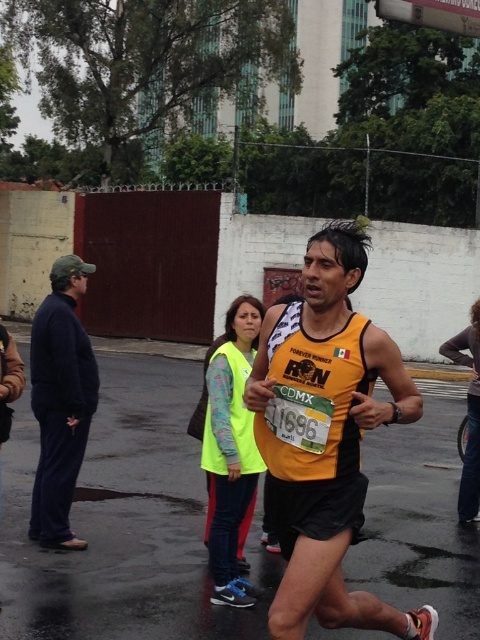
Who is more forward, (45, 412) or (205, 422)?

Point (205, 422) is more forward.

Can you confirm if dark blue fleece at left is positioned below neon yellow vest at center?

Incorrect, dark blue fleece at left is not positioned below neon yellow vest at center.

Between point (51, 499) and point (237, 429), which one is positioned in front?

Point (237, 429) is more forward.

What are the coordinates of `dark blue fleece at left` in the screenshot? It's located at (60, 401).

Between yellow fabric tank top at center and dark blue fleece at left, which one appears on the left side from the viewer's perspective?

From the viewer's perspective, dark blue fleece at left appears more on the left side.

Is yellow fabric tank top at center bigger than dark blue fleece at left?

Yes, yellow fabric tank top at center is bigger than dark blue fleece at left.

You are a GUI agent. You are given a task and a screenshot of the screen. Output one action in this format:
    pyautogui.click(x=<x>, y=<y>)
    Task: Click on the yellow fabric tank top at center
    
    Given the screenshot: What is the action you would take?
    pyautogui.click(x=325, y=436)

At what (x,y) coordinates should I click in order to perform the action: click on yellow fabric tank top at center. Please return your answer as a coordinate pair (x, y). The width and height of the screenshot is (480, 640). Looking at the image, I should click on (325, 436).

Is yellow fabric tank top at center wider than neon yellow vest at center?

Indeed, yellow fabric tank top at center has a greater width compared to neon yellow vest at center.

Between yellow fabric tank top at center and neon yellow vest at center, which one has more height?

With more height is yellow fabric tank top at center.

Which is in front, point (303, 460) or point (230, 493)?

Positioned in front is point (303, 460).

Image resolution: width=480 pixels, height=640 pixels. What are the coordinates of `yellow fabric tank top at center` in the screenshot? It's located at (325, 436).